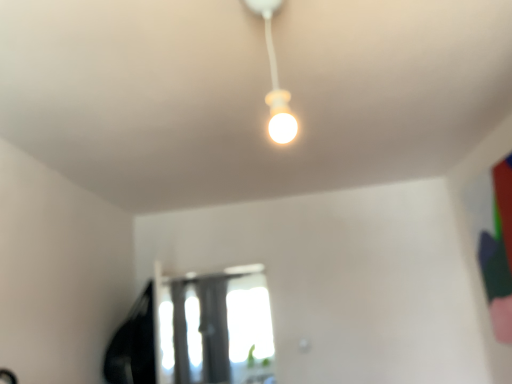
Question: Considering the positions of transparent glass window at center and matte white bulb at center in the image, is transparent glass window at center taller or shorter than matte white bulb at center?

Choices:
 (A) short
 (B) tall

Answer: (B)

Question: Do you think transparent glass window at center is within matte white bulb at center, or outside of it?

Choices:
 (A) outside
 (B) inside

Answer: (A)

Question: From the image's perspective, is transparent glass window at center located above or below matte white bulb at center?

Choices:
 (A) below
 (B) above

Answer: (A)

Question: Considering their positions, is matte white bulb at center located in front of or behind transparent glass window at center?

Choices:
 (A) behind
 (B) front

Answer: (B)

Question: Based on their positions, is matte white bulb at center located to the left or right of transparent glass window at center?

Choices:
 (A) left
 (B) right

Answer: (B)

Question: Based on their sizes in the image, would you say matte white bulb at center is bigger or smaller than transparent glass window at center?

Choices:
 (A) big
 (B) small

Answer: (B)

Question: From a real-world perspective, is matte white bulb at center above or below transparent glass window at center?

Choices:
 (A) below
 (B) above

Answer: (B)